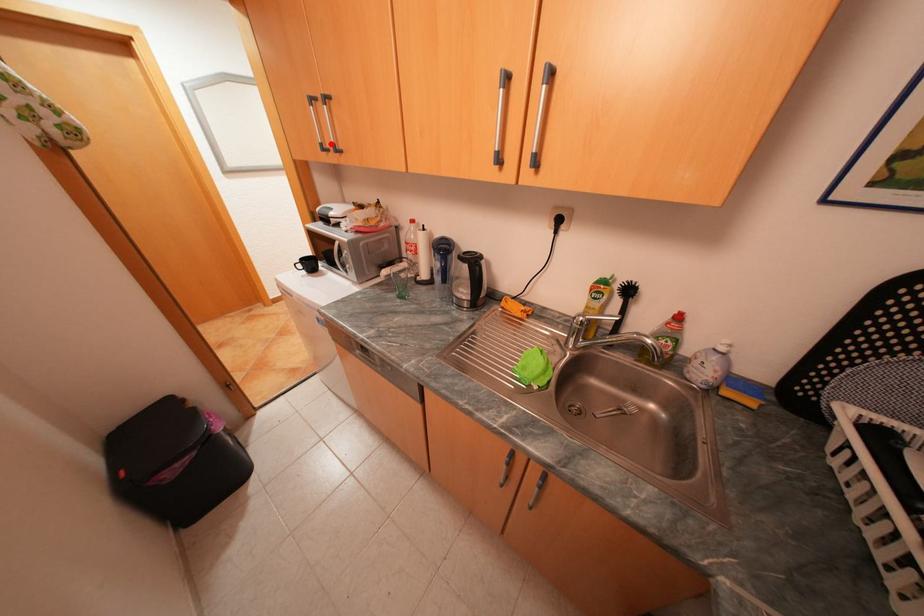
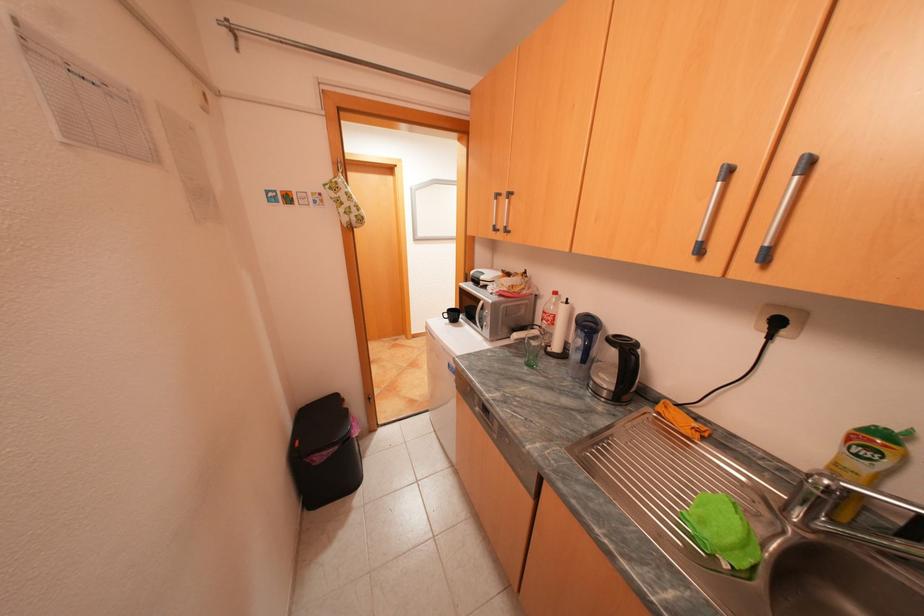
Question: I am providing you with two images of the same scene from different viewpoints. A red point is marked on the first image. Is the red point's position out of view in image 2?

Choices:
 (A) Yes
 (B) No

Answer: (B)